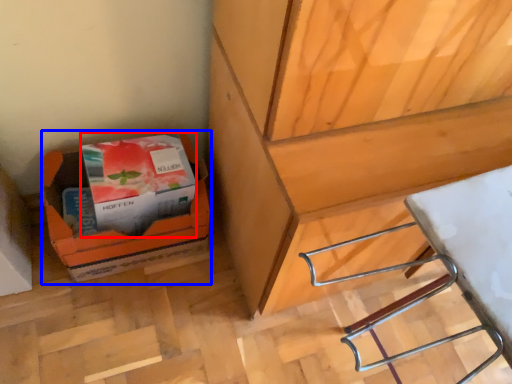
Question: Which object is further to the camera taking this photo, paperback book (highlighted by a red box) or cardboard box (highlighted by a blue box)?

Choices:
 (A) paperback book
 (B) cardboard box

Answer: (B)